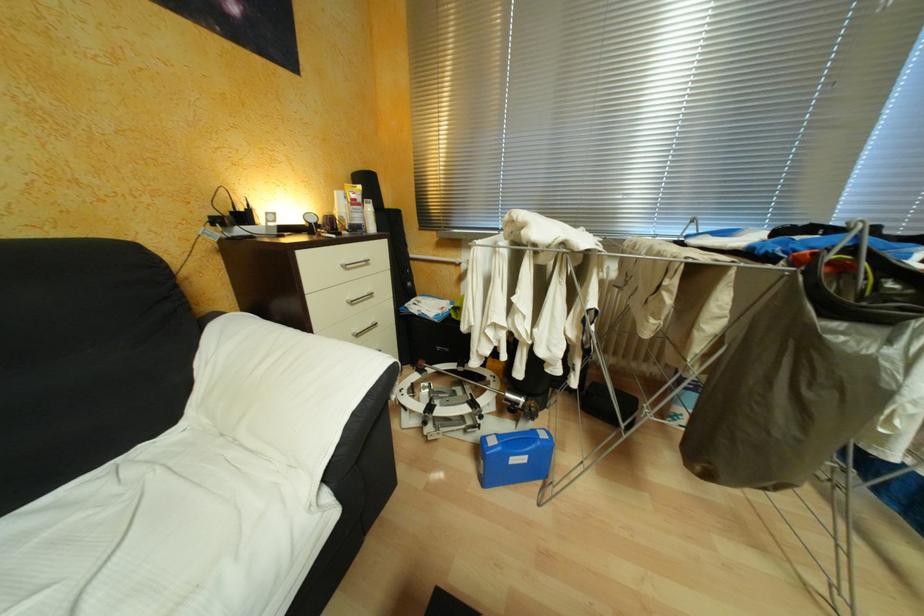
Where is `blue case handle`? blue case handle is located at coordinates (521, 446).